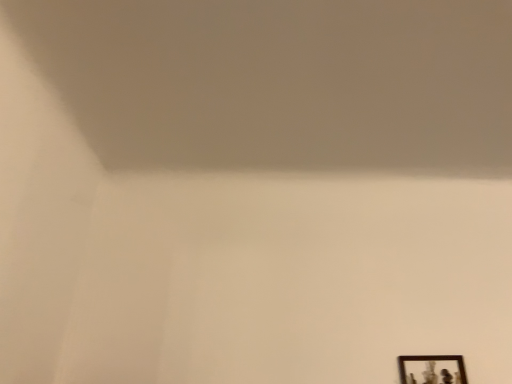
Question: From the image's perspective, is white matte wall at upper center located above or below wooden framed picture at lower right?

Choices:
 (A) above
 (B) below

Answer: (A)

Question: Is point (251, 122) positioned closer to the camera than point (402, 370)?

Choices:
 (A) farther
 (B) closer

Answer: (A)

Question: Visually, is white matte wall at upper center positioned to the left or to the right of wooden framed picture at lower right?

Choices:
 (A) right
 (B) left

Answer: (B)

Question: From the image's perspective, is wooden framed picture at lower right located above or below white matte wall at upper center?

Choices:
 (A) below
 (B) above

Answer: (A)

Question: Considering the positions of wooden framed picture at lower right and white matte wall at upper center in the image, is wooden framed picture at lower right taller or shorter than white matte wall at upper center?

Choices:
 (A) tall
 (B) short

Answer: (A)

Question: In the image, is wooden framed picture at lower right positioned in front of or behind white matte wall at upper center?

Choices:
 (A) front
 (B) behind

Answer: (B)

Question: Does point (455, 357) appear closer or farther from the camera than point (28, 18)?

Choices:
 (A) farther
 (B) closer

Answer: (A)